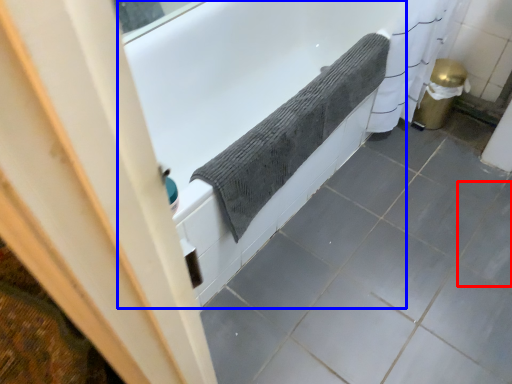
Question: Which of the following is the closest to the observer, ceramic tile (highlighted by a red box) or bathtub (highlighted by a blue box)?

Choices:
 (A) ceramic tile
 (B) bathtub

Answer: (B)